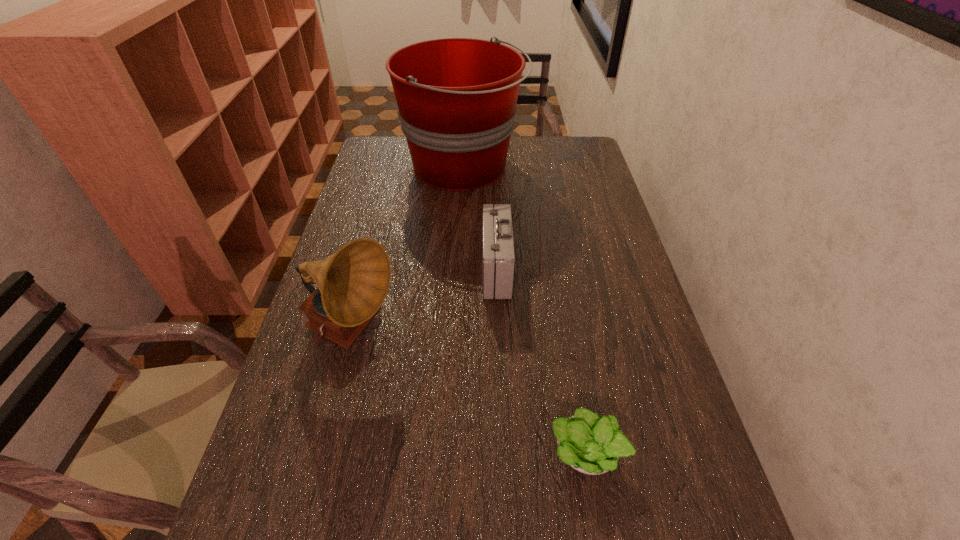
Locate an element on the screen. The image size is (960, 540). free space between the first-aid kit and the phonograph record is located at coordinates (424, 302).

Where is `free space between the nearest object and the third shortest object`? This screenshot has width=960, height=540. free space between the nearest object and the third shortest object is located at coordinates (470, 394).

I want to click on free point between the tallest object and the shortest object, so click(525, 310).

This screenshot has width=960, height=540. I want to click on vacant space in between the phonograph record and the second shortest object, so click(x=424, y=302).

The image size is (960, 540). In order to click on vacant space that is in between the bucket and the third tallest object in this screenshot , I will do `click(479, 218)`.

You are a GUI agent. You are given a task and a screenshot of the screen. Output one action in this format:
    pyautogui.click(x=<x>, y=<y>)
    Task: Click on the vacant space that is in between the phonograph record and the bucket
    
    Given the screenshot: What is the action you would take?
    pyautogui.click(x=408, y=250)

This screenshot has height=540, width=960. What are the coordinates of `vacant area between the phonograph record and the nearest object` in the screenshot? It's located at (470, 394).

Identify the location of free space between the second tallest object and the farthest object. (408, 250).

Where is `unoccupied area between the shortest object and the phonograph record`? This screenshot has height=540, width=960. unoccupied area between the shortest object and the phonograph record is located at coordinates (470, 394).

The image size is (960, 540). I want to click on vacant space in between the lettuce and the first-aid kit, so click(541, 361).